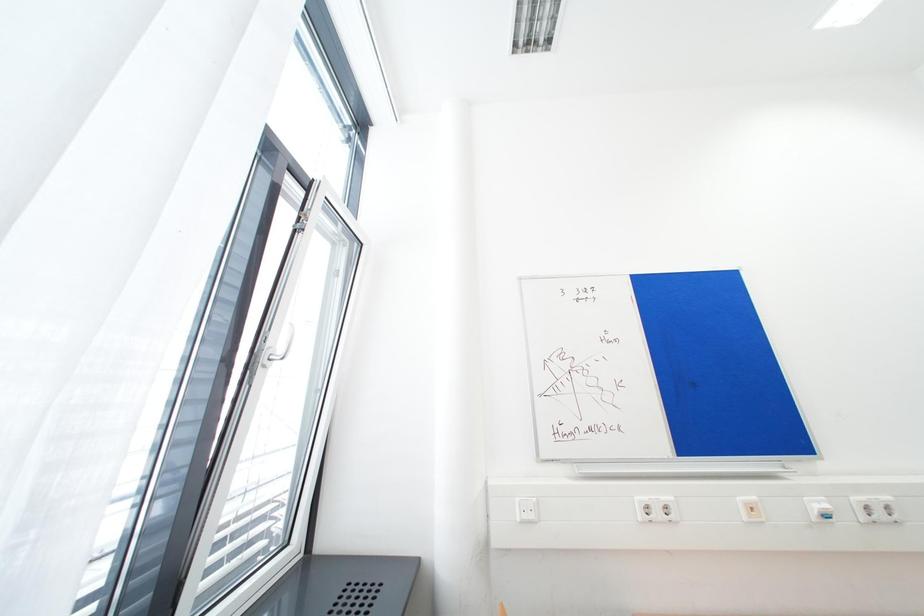
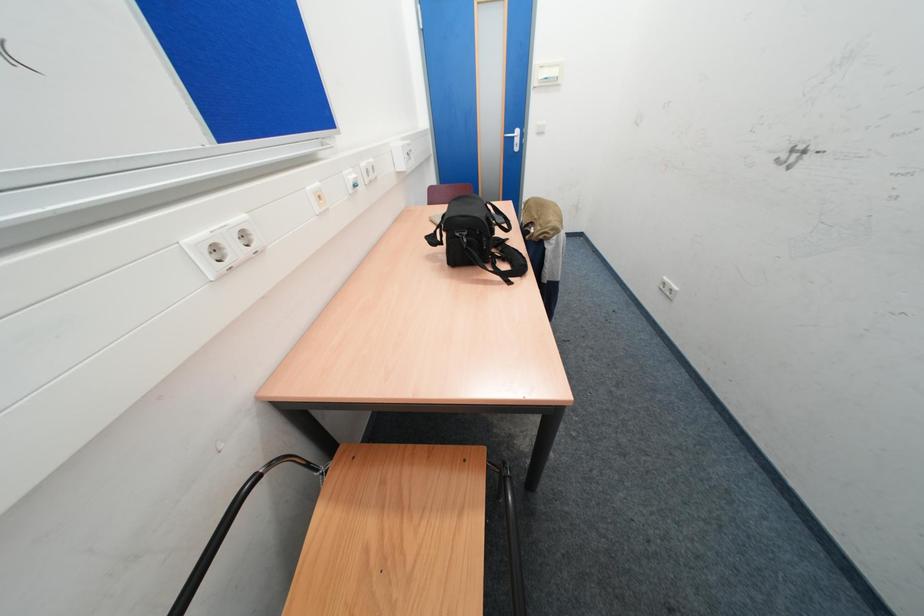
First-person continuous shooting, in which direction is the camera rotating?

The rotation direction of the camera is right-down.